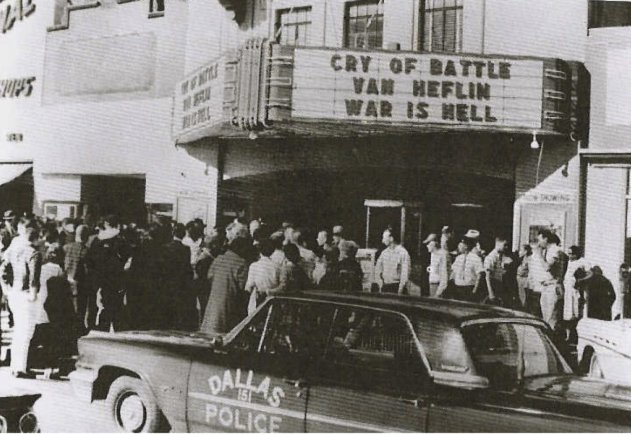
Where is `wall`? The image size is (631, 434). wall is located at coordinates (337, 34).